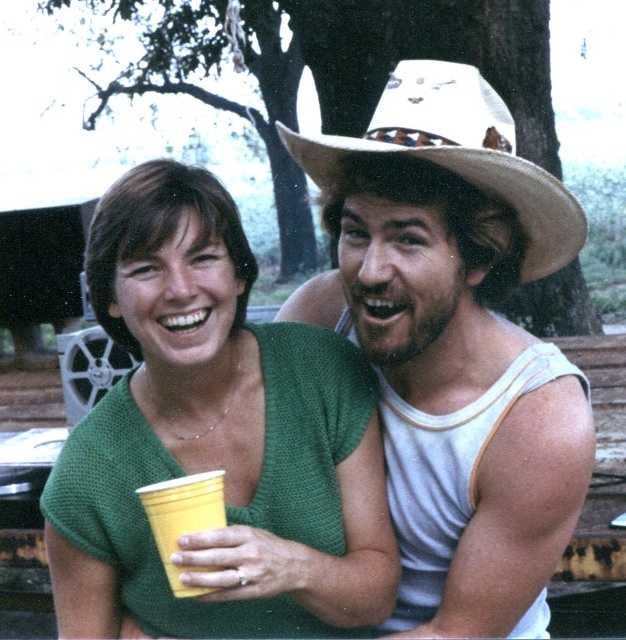
Can you confirm if white straw cowboy hat at upper right is shorter than yellow paper cup at lower left?

Incorrect, white straw cowboy hat at upper right's height does not fall short of yellow paper cup at lower left's.

Can you confirm if white straw cowboy hat at upper right is thinner than yellow paper cup at lower left?

Incorrect, white straw cowboy hat at upper right's width is not less than yellow paper cup at lower left's.

Who is more forward, (444, 68) or (190, 531)?

Positioned in front is point (190, 531).

This screenshot has height=640, width=626. Find the location of `white straw cowboy hat at upper right`. white straw cowboy hat at upper right is located at coordinates (458, 154).

From the picture: Can you confirm if green knitted shirt at center is thinner than yellow paper cup at lower left?

In fact, green knitted shirt at center might be wider than yellow paper cup at lower left.

Identify the location of green knitted shirt at center. The height and width of the screenshot is (640, 626). (213, 440).

Between point (88, 625) and point (162, 486), which one is positioned behind?

Positioned behind is point (88, 625).

Locate an element on the screen. The height and width of the screenshot is (640, 626). green knitted shirt at center is located at coordinates (213, 440).

Who is positioned more to the left, white woven cowboy hat at upper right or yellow paper cup at lower left?

yellow paper cup at lower left

Can you confirm if white woven cowboy hat at upper right is taller than yellow paper cup at lower left?

Correct, white woven cowboy hat at upper right is much taller as yellow paper cup at lower left.

Which is in front, point (357, 244) or point (198, 484)?

Point (198, 484) is more forward.

The image size is (626, 640). I want to click on white woven cowboy hat at upper right, so click(456, 344).